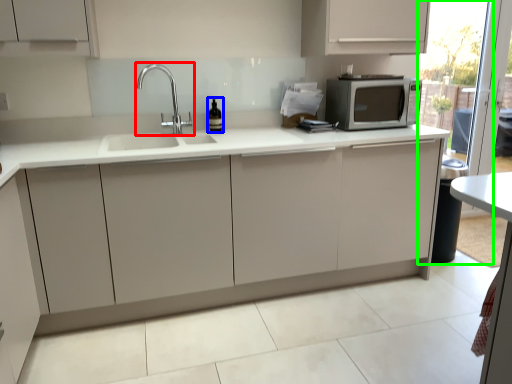
Question: Considering the real-world distances, which object is closest to tap (highlighted by a red box)? wine bottle (highlighted by a blue box) or screen door (highlighted by a green box).

Choices:
 (A) wine bottle
 (B) screen door

Answer: (A)